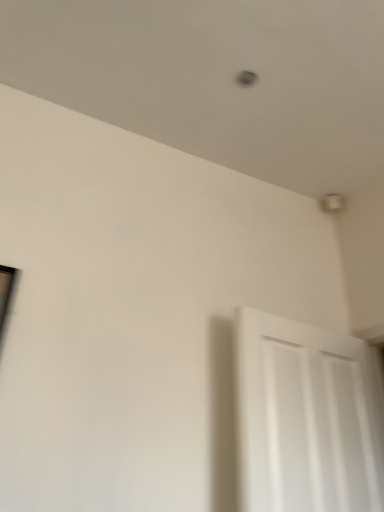
Question: Should I look upward or downward to see white matte door at lower right?

Choices:
 (A) down
 (B) up

Answer: (A)